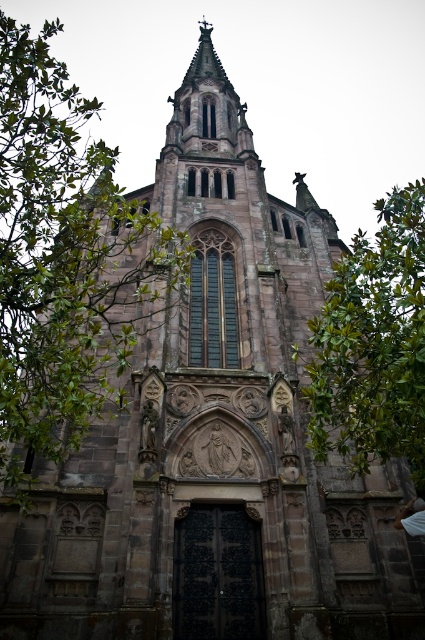
Is green leafy tree at left thinner than green leafy tree at right?

Correct, green leafy tree at left's width is less than green leafy tree at right's.

Is green leafy tree at left bigger than green leafy tree at right?

Indeed, green leafy tree at left has a larger size compared to green leafy tree at right.

The image size is (425, 640). I want to click on green leafy tree at left, so click(65, 260).